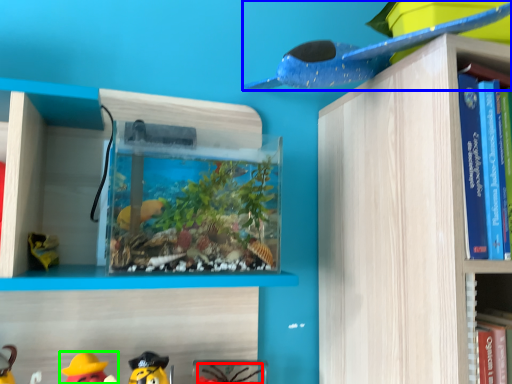
Question: Estimate the real-world distances between objects in this image. Which object is farther from toy (highlighted by a red box), toy (highlighted by a blue box) or toy (highlighted by a green box)?

Choices:
 (A) toy
 (B) toy

Answer: (A)